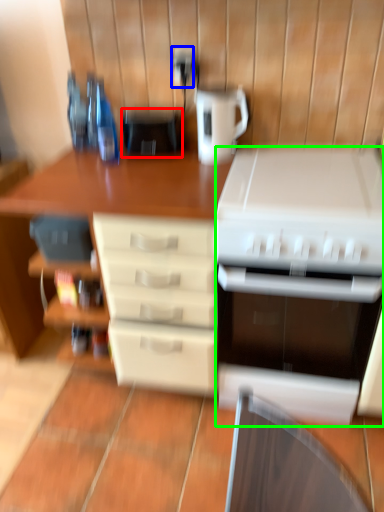
Question: Which object is positioned farthest from appliance (highlighted by a red box)? Select from electric outlet (highlighted by a blue box) and kitchen appliance (highlighted by a green box).

Choices:
 (A) electric outlet
 (B) kitchen appliance

Answer: (B)